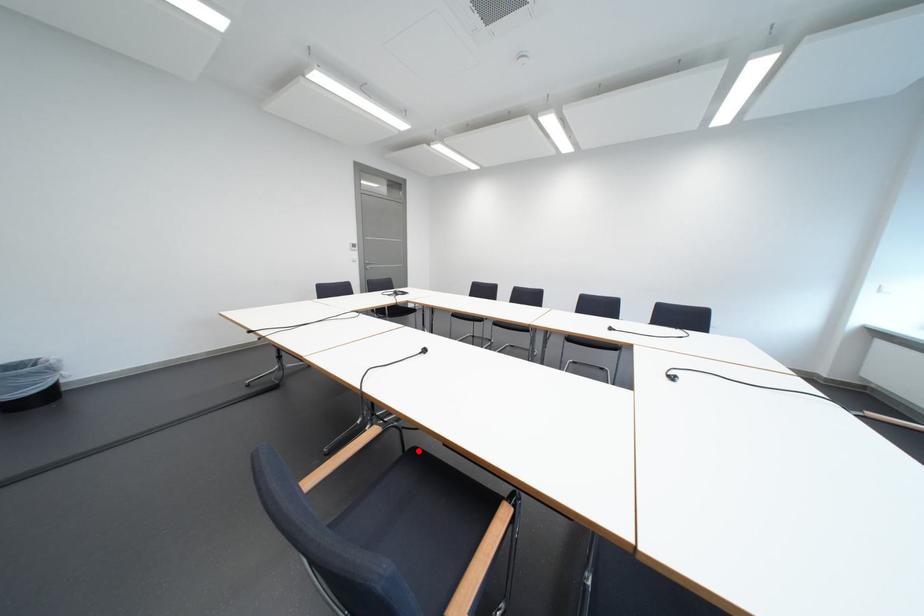
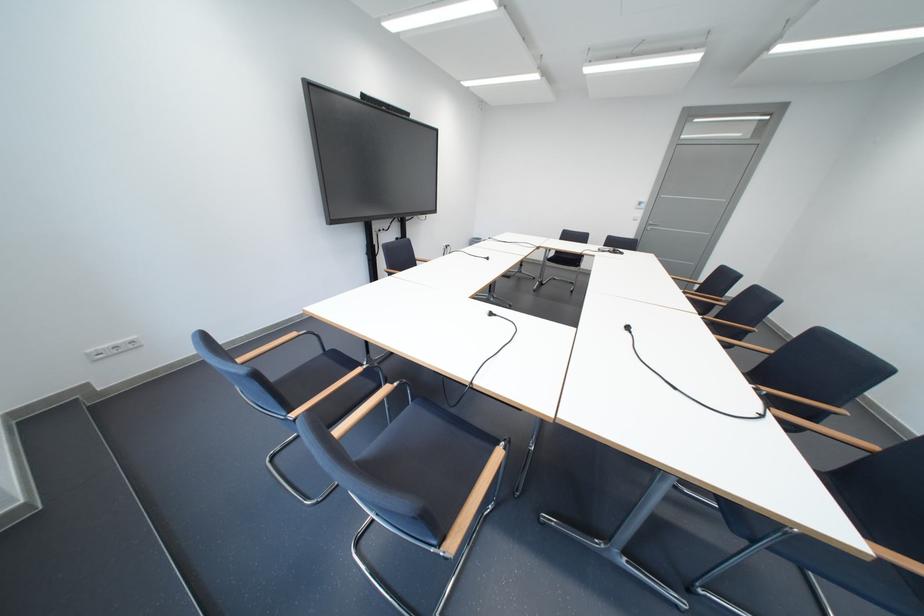
Question: I am providing you with two images of the same scene from different viewpoints. A red point is marked on the first image. Is the red point's position out of view in image 2?

Choices:
 (A) Yes
 (B) No

Answer: (A)